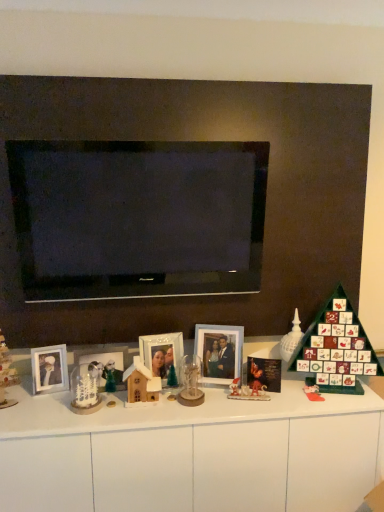
The height and width of the screenshot is (512, 384). Find the location of `free space in front of matte white glass dome at lower left`. free space in front of matte white glass dome at lower left is located at coordinates (8, 421).